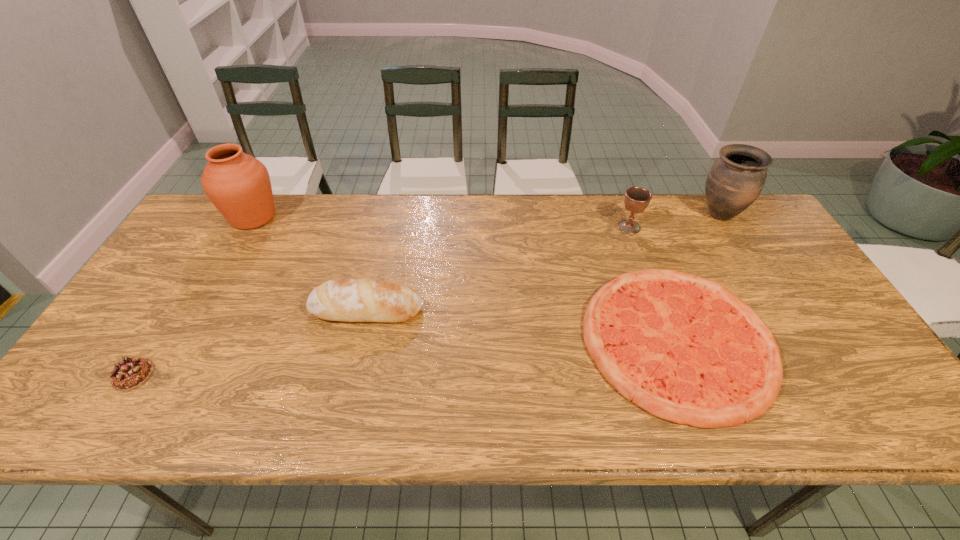
Locate an element on the screen. The image size is (960, 540). free space located on the left of the bread is located at coordinates coord(242,309).

Image resolution: width=960 pixels, height=540 pixels. Find the location of `free space located on the right of the chocolate cake`. free space located on the right of the chocolate cake is located at coordinates pos(235,375).

Image resolution: width=960 pixels, height=540 pixels. What are the coordinates of `vacant space located on the left of the shortest object` in the screenshot? It's located at (420, 340).

Identify the location of chalice at the far edge. (636, 199).

Locate an element on the screen. object that is at the near edge is located at coordinates (685, 349).

This screenshot has height=540, width=960. In order to click on urn positioned at the left edge in this screenshot , I will do `click(239, 186)`.

Locate an element on the screen. Image resolution: width=960 pixels, height=540 pixels. chocolate cake that is positioned at the left edge is located at coordinates (129, 374).

This screenshot has height=540, width=960. What are the coordinates of `object that is at the right edge` in the screenshot? It's located at (735, 180).

Find the location of `object that is at the far left corner`. object that is at the far left corner is located at coordinates (239, 186).

Locate an element on the screen. The width and height of the screenshot is (960, 540). object situated at the far right corner is located at coordinates (735, 180).